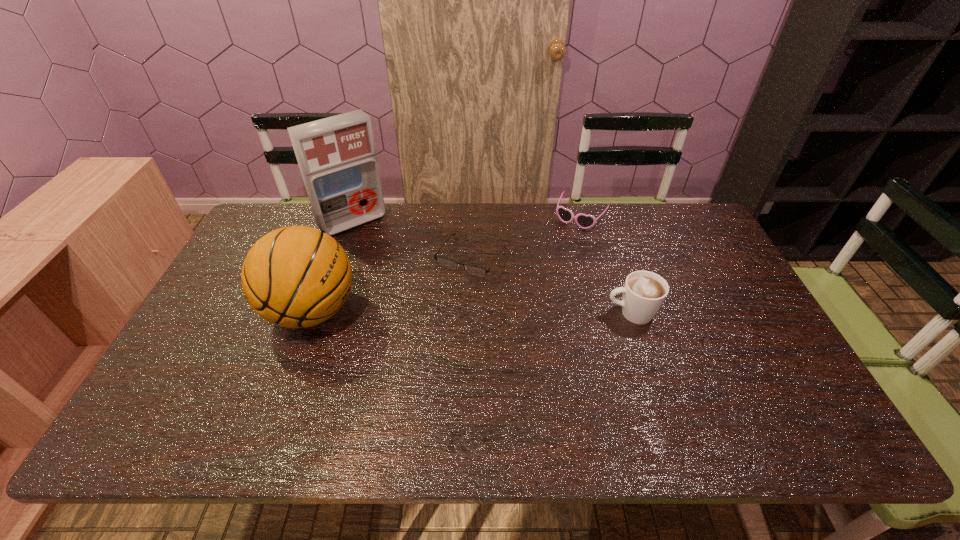
You are a GUI agent. You are given a task and a screenshot of the screen. Output one action in this format:
    pyautogui.click(x=<x>, y=<y>)
    Task: Click on the second tallest object
    
    Given the screenshot: What is the action you would take?
    pyautogui.click(x=297, y=276)

Image resolution: width=960 pixels, height=540 pixels. I want to click on cappuccino, so click(644, 292).

The height and width of the screenshot is (540, 960). I want to click on spectacles, so click(x=445, y=262).

Where is `the shortest object`? The height and width of the screenshot is (540, 960). the shortest object is located at coordinates tap(445, 262).

Where is `sunglasses`? The height and width of the screenshot is (540, 960). sunglasses is located at coordinates (584, 221).

Locate an element on the screen. the tallest object is located at coordinates [337, 158].

Where is `vacant position located on the surface of the basketball near the brand logo`? This screenshot has height=540, width=960. vacant position located on the surface of the basketball near the brand logo is located at coordinates (232, 311).

I want to click on vacant region located on the surface of the basketball near the brand logo, so click(x=211, y=311).

The width and height of the screenshot is (960, 540). In order to click on vacant space located on the surface of the basketball near the brand logo in this screenshot , I will do `click(218, 311)`.

At what (x,y) coordinates should I click in order to perform the action: click on free space located 0.300m with the handle on the side of the cappuccino. Please return your answer as a coordinate pair (x, y). Looking at the image, I should click on (497, 313).